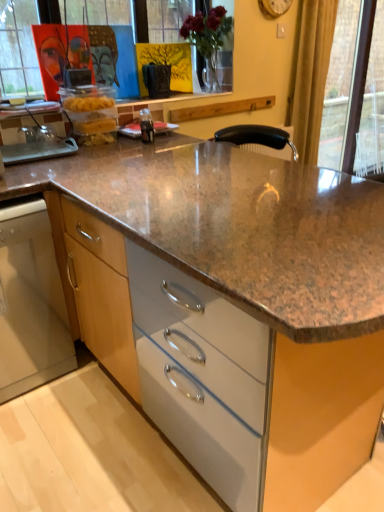
Question: Is transparent glass door at upper right taller or shorter than gold textured curtain at right?

Choices:
 (A) short
 (B) tall

Answer: (B)

Question: From the image's perspective, is transparent glass door at upper right above or below gold textured curtain at right?

Choices:
 (A) below
 (B) above

Answer: (B)

Question: Which object is positioned closest to the gold textured curtain at right?

Choices:
 (A) transparent glass door at upper right
 (B) satin stainless steel dishwasher at lower left

Answer: (A)

Question: Based on their relative distances, which object is nearer to the satin stainless steel dishwasher at lower left?

Choices:
 (A) gold textured curtain at right
 (B) transparent glass door at upper right

Answer: (A)